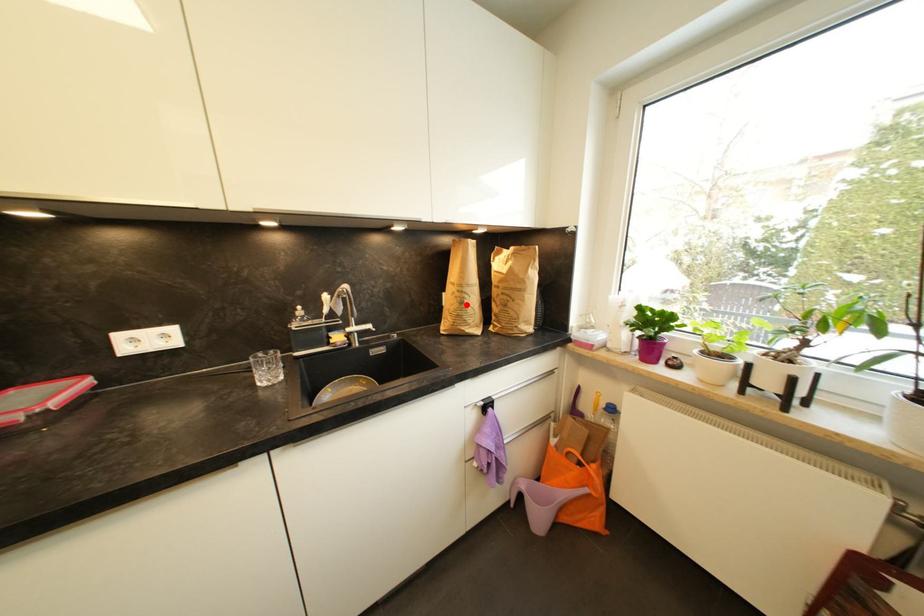
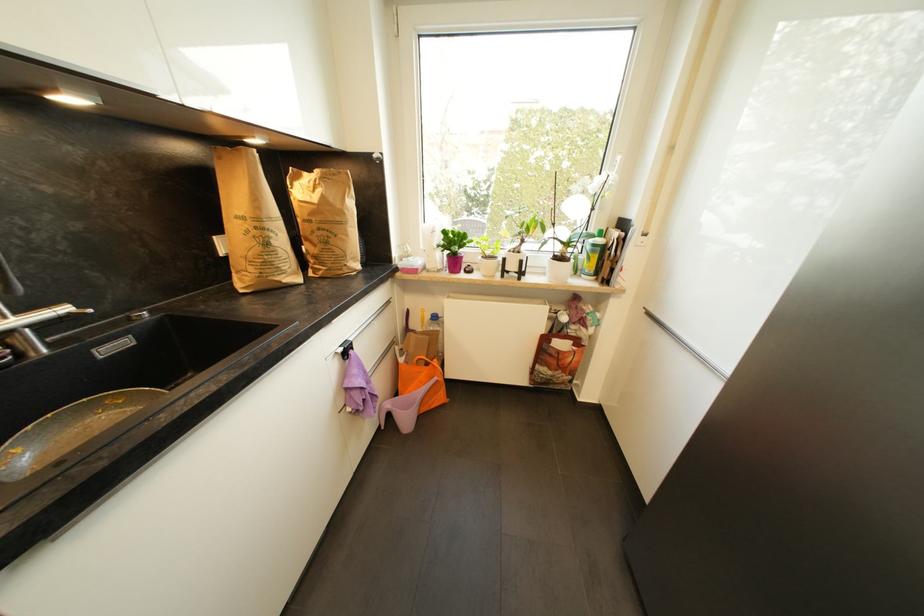
Find the pixel in the second image that matches the highlighted location in the first image.

(272, 246)